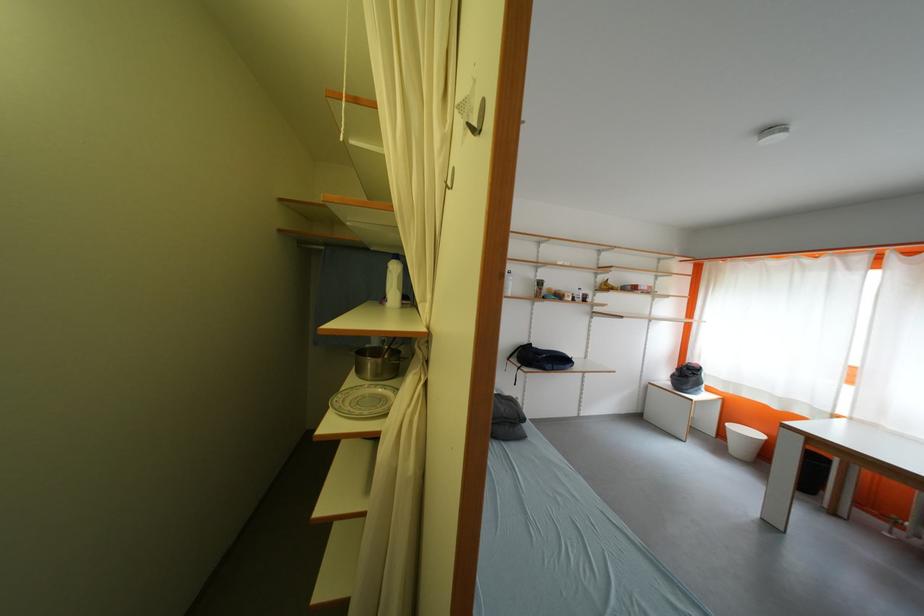
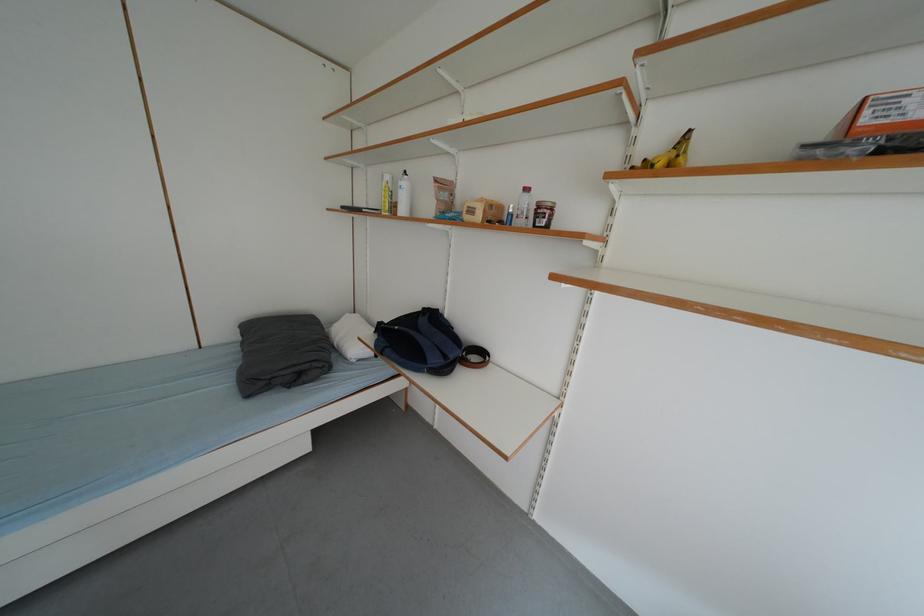
Find the pixel in the second image that matches [579,302] in the first image.

(487, 220)